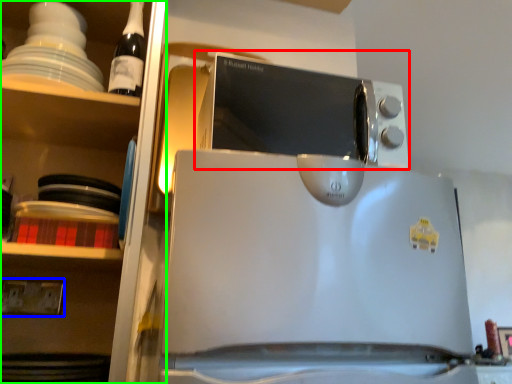
Question: Which object is the farthest from microwave oven (highlighted by a red box)? Choose among these: electric outlet (highlighted by a blue box) or shelf (highlighted by a green box).

Choices:
 (A) electric outlet
 (B) shelf

Answer: (A)